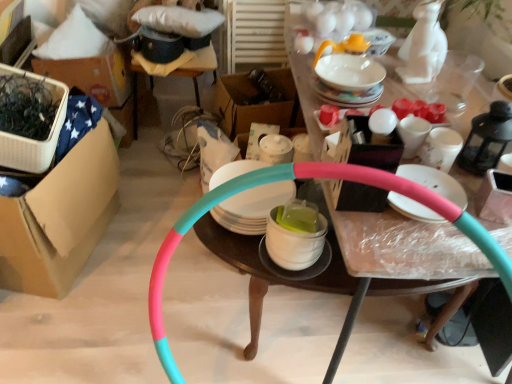
Locate an element on the screen. This screenshot has width=512, height=384. free space in front of white glossy mug at upper right, arranged as the 4th tableware when ordered from the bottom is located at coordinates (469, 211).